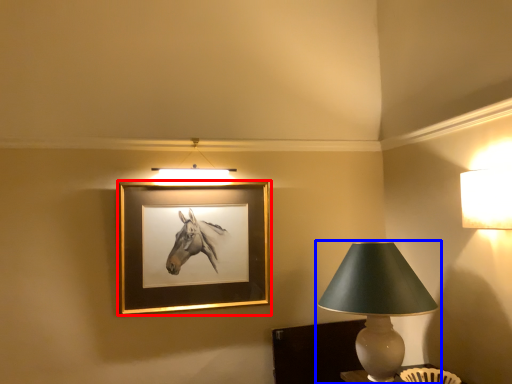
Question: Which object appears farthest to the camera in this image, picture frame (highlighted by a red box) or lamp (highlighted by a blue box)?

Choices:
 (A) picture frame
 (B) lamp

Answer: (A)